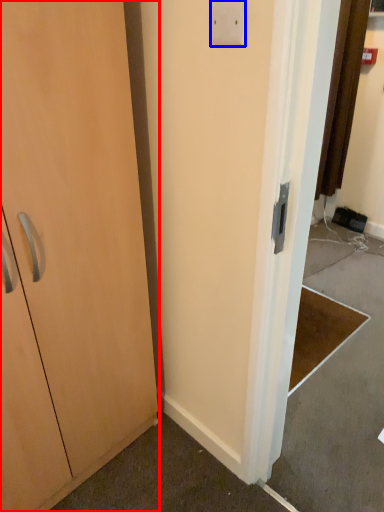
Question: Which point is further to the camera, cabinetry (highlighted by a red box) or light switch (highlighted by a blue box)?

Choices:
 (A) cabinetry
 (B) light switch

Answer: (B)